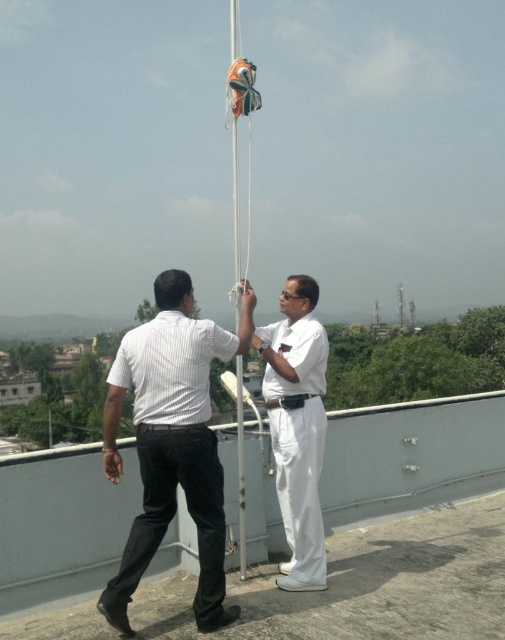
Can you confirm if white striped shirt at center is shorter than white glossy sailor at center?

No.

Who is lower down, white striped shirt at center or white glossy sailor at center?

white glossy sailor at center is lower down.

Where is `white striped shirt at center`? white striped shirt at center is located at coordinates (172, 442).

You are a GUI agent. You are given a task and a screenshot of the screen. Output one action in this format:
    pyautogui.click(x=<x>, y=<y>)
    Task: Click on the white striped shirt at center
    Image resolution: width=505 pixels, height=640 pixels.
    Given the screenshot: What is the action you would take?
    172,442